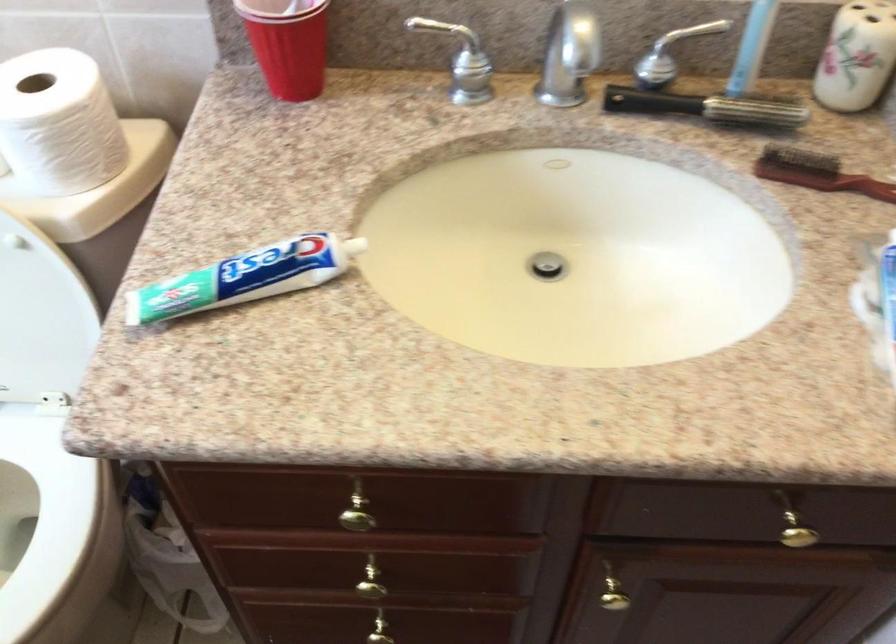
What do you see at coordinates (613, 601) in the screenshot? I see `the gold cabinet knob` at bounding box center [613, 601].